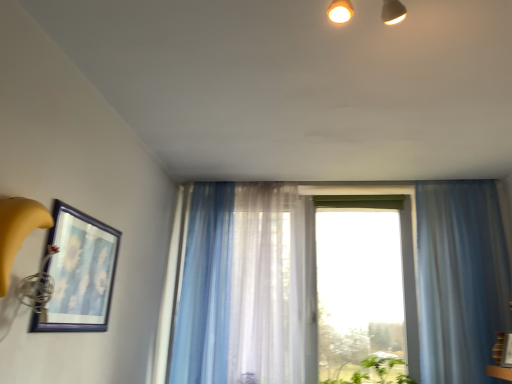
Question: Does translucent blue curtain at right, which is the first curtain in right-to-left order, have a greater width compared to translucent fabric window at center?

Choices:
 (A) yes
 (B) no

Answer: (B)

Question: Is translucent fabric window at center inside translucent blue curtain at right, which is the first curtain in right-to-left order?

Choices:
 (A) no
 (B) yes

Answer: (A)

Question: Could you tell me if translucent blue curtain at right, which is the first curtain in right-to-left order, is facing translucent fabric window at center?

Choices:
 (A) no
 (B) yes

Answer: (A)

Question: Is translucent blue curtain at right, the third curtain from the left, at the right side of translucent fabric window at center?

Choices:
 (A) yes
 (B) no

Answer: (A)

Question: Does translucent blue curtain at right, the third curtain from the left, have a lesser width compared to translucent fabric window at center?

Choices:
 (A) no
 (B) yes

Answer: (B)

Question: Is translucent blue curtain at right, which is the first curtain in right-to-left order, positioned far away from translucent fabric window at center?

Choices:
 (A) no
 (B) yes

Answer: (A)

Question: Could you tell me if translucent blue curtain at right, which is the first curtain in right-to-left order, is facing matte blue picture frame at left?

Choices:
 (A) no
 (B) yes

Answer: (A)

Question: Is matte blue picture frame at left inside translucent blue curtain at right, the third curtain from the left?

Choices:
 (A) no
 (B) yes

Answer: (A)

Question: Is the depth of translucent blue curtain at right, the third curtain from the left, greater than that of matte blue picture frame at left?

Choices:
 (A) yes
 (B) no

Answer: (A)

Question: Are translucent blue curtain at right, which is the first curtain in right-to-left order, and matte blue picture frame at left located far from each other?

Choices:
 (A) no
 (B) yes

Answer: (B)

Question: Considering the relative sizes of translucent blue curtain at right, which is the first curtain in right-to-left order, and matte blue picture frame at left in the image provided, is translucent blue curtain at right, which is the first curtain in right-to-left order, shorter than matte blue picture frame at left?

Choices:
 (A) no
 (B) yes

Answer: (A)

Question: From the image's perspective, is translucent blue curtain at right, the third curtain from the left, beneath matte blue picture frame at left?

Choices:
 (A) yes
 (B) no

Answer: (A)

Question: Is matte blue picture frame at left not within translucent blue curtain at center, placed as the 3th curtain when sorted from right to left?

Choices:
 (A) no
 (B) yes

Answer: (B)